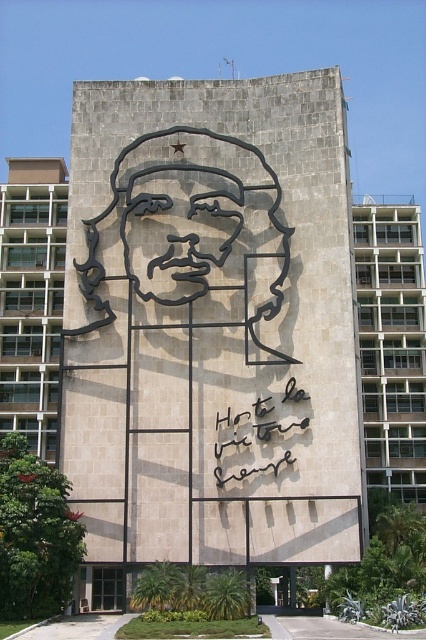
Question: Does white matte text at center come in front of black matte sculpture at center?

Choices:
 (A) yes
 (B) no

Answer: (A)

Question: Which object is farther from the camera taking this photo?

Choices:
 (A) black matte sculpture at center
 (B) white matte text at center

Answer: (A)

Question: Does white matte text at center appear on the left side of black matte sculpture at center?

Choices:
 (A) no
 (B) yes

Answer: (A)

Question: Which of the following is the farthest from the observer?

Choices:
 (A) white matte text at center
 (B) black matte sculpture at center

Answer: (B)

Question: Is white matte text at center smaller than black matte sculpture at center?

Choices:
 (A) no
 (B) yes

Answer: (B)